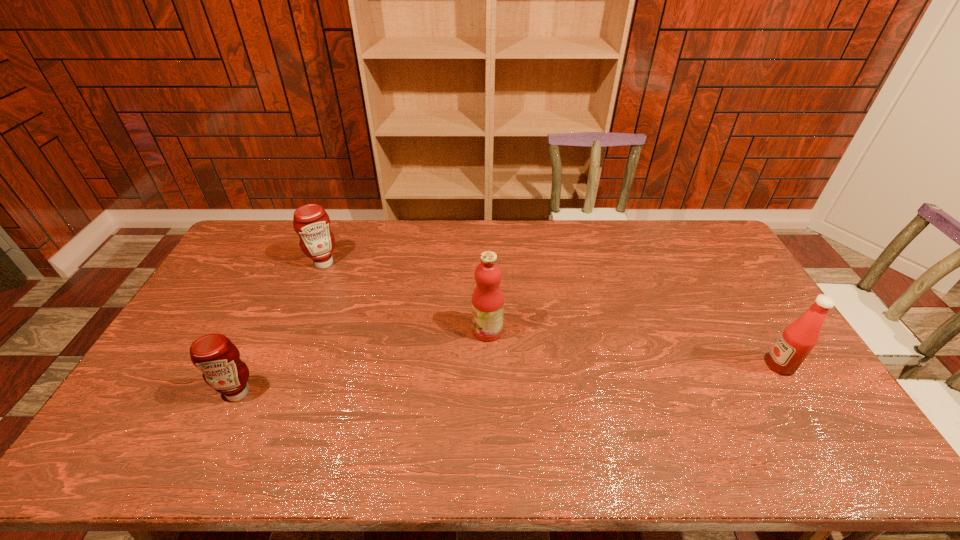
Where is `fruit juice`? fruit juice is located at coordinates (487, 299).

Identify the location of the second farthest object. (487, 299).

At what (x,y) coordinates should I click in order to perform the action: click on the rightmost object. Please return your answer as a coordinate pair (x, y). The width and height of the screenshot is (960, 540). Looking at the image, I should click on (798, 339).

Find the location of `the second farthest condiment`. the second farthest condiment is located at coordinates (798, 339).

Image resolution: width=960 pixels, height=540 pixels. What are the coordinates of `the farthest condiment` in the screenshot? It's located at (311, 222).

I want to click on the nearest condiment, so click(215, 355).

Image resolution: width=960 pixels, height=540 pixels. What are the coordinates of `vacant space located 0.060m on the front label of the fruit juice` in the screenshot? It's located at (452, 330).

You are a GUI agent. You are given a task and a screenshot of the screen. Output one action in this format:
    pyautogui.click(x=<x>, y=<y>)
    Task: Click on the vacant region located 0.110m on the front label of the fruit juice
    The image size is (960, 540).
    Given the screenshot: What is the action you would take?
    pyautogui.click(x=436, y=330)

I want to click on free spot located 0.230m on the front label of the fruit juice, so click(396, 330).

You are a GUI agent. You are given a task and a screenshot of the screen. Output one action in this format:
    pyautogui.click(x=<x>, y=<y>)
    Task: Click on the blank area located on the front-facing side of the second nearest condiment
    Image resolution: width=960 pixels, height=540 pixels.
    Given the screenshot: What is the action you would take?
    pyautogui.click(x=692, y=365)